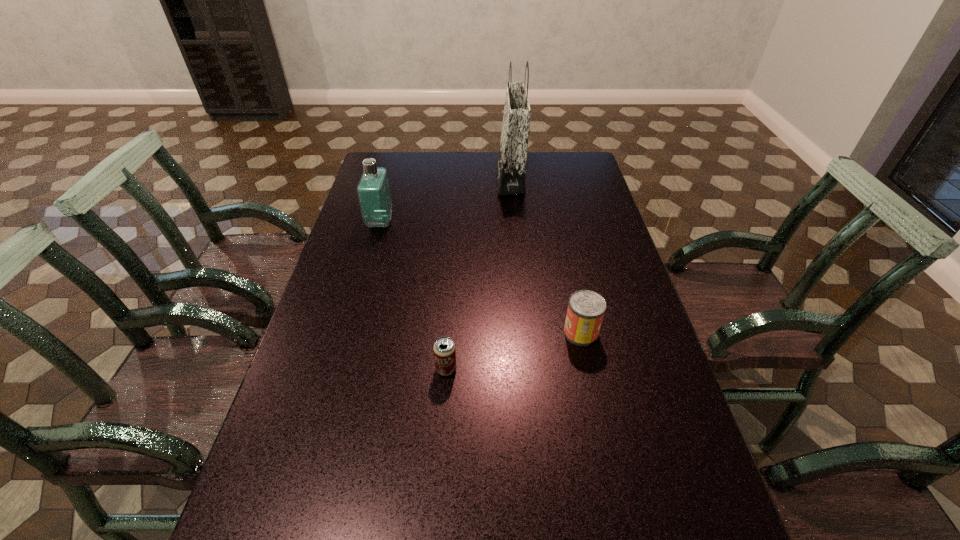
You are a GUI agent. You are given a task and a screenshot of the screen. Output one action in this format:
    pyautogui.click(x=<x>, y=<y>)
    Task: Click on the vacant area in the image that satisfies the following two spatial constraints: 1. on the front label of the second nearest object; 2. on the left side of the third shortest object
    This screenshot has width=960, height=540.
    Given the screenshot: What is the action you would take?
    pyautogui.click(x=349, y=333)

You are a GUI agent. You are given a task and a screenshot of the screen. Output one action in this format:
    pyautogui.click(x=<x>, y=<y>)
    Task: Click on the vacant space that satisfies the following two spatial constraints: 1. on the front label of the can; 2. on the right side of the third nearest object
    
    Given the screenshot: What is the action you would take?
    pyautogui.click(x=349, y=333)

The width and height of the screenshot is (960, 540). In order to click on free location that satisfies the following two spatial constraints: 1. on the back side of the nearest object; 2. on the front label of the third nearest object in this screenshot , I will do `click(456, 222)`.

The height and width of the screenshot is (540, 960). I want to click on free location that satisfies the following two spatial constraints: 1. on the front of the tallest object with the design; 2. on the back side of the rightmost object, so click(524, 333).

Locate an element on the screen. This screenshot has width=960, height=540. vacant space that satisfies the following two spatial constraints: 1. on the front label of the second farthest object; 2. on the back side of the beer can is located at coordinates (339, 369).

Find the location of a particular element. This screenshot has height=540, width=960. free location that satisfies the following two spatial constraints: 1. on the front label of the leftmost object; 2. on the back side of the shortest object is located at coordinates (339, 369).

Where is `vacant area that satisfies the following two spatial constraints: 1. on the front of the shopping bag with the design; 2. on the left side of the rightmost object`? The width and height of the screenshot is (960, 540). vacant area that satisfies the following two spatial constraints: 1. on the front of the shopping bag with the design; 2. on the left side of the rightmost object is located at coordinates (524, 333).